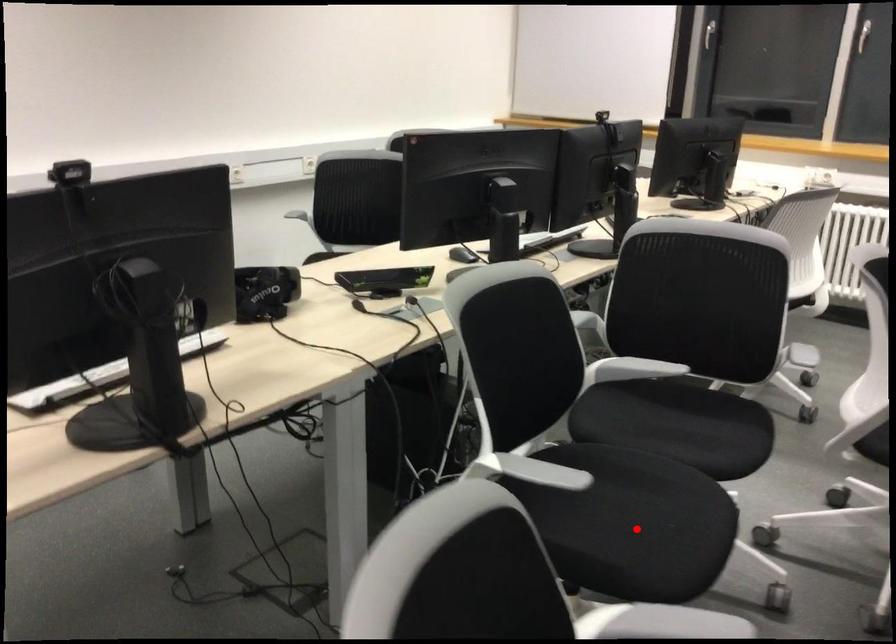
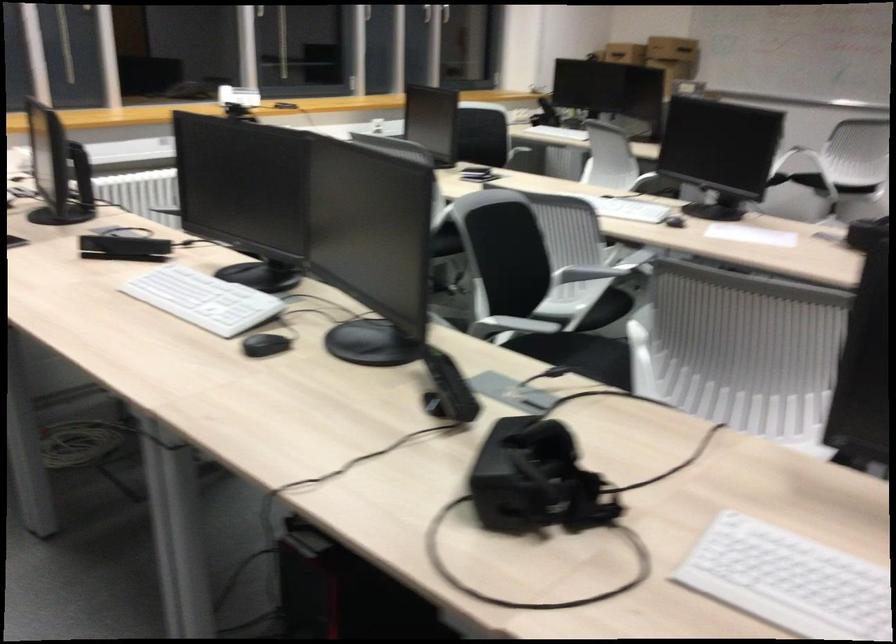
Question: I am providing you with two images of the same scene from different viewpoints. A red point is marked on the first image. Is the red point's position out of view in image 2?

Choices:
 (A) Yes
 (B) No

Answer: (A)